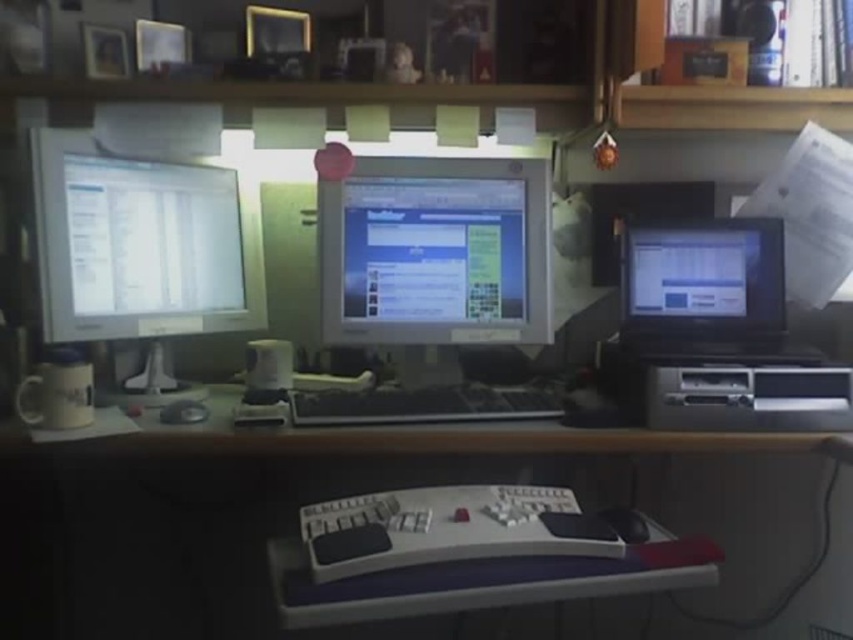
Can you confirm if matte silver monitor at left is bigger than matte plastic monitor at center?

Indeed, matte silver monitor at left has a larger size compared to matte plastic monitor at center.

Consider the image. Is matte silver monitor at left to the right of matte plastic monitor at center from the viewer's perspective?

Incorrect, matte silver monitor at left is not on the right side of matte plastic monitor at center.

Describe the element at coordinates (140, 250) in the screenshot. I see `matte silver monitor at left` at that location.

Locate an element on the screen. matte silver monitor at left is located at coordinates (140, 250).

Based on the photo, can you confirm if wooden computer desk at center is positioned below black rubber mouse at lower center?

Yes, wooden computer desk at center is below black rubber mouse at lower center.

Is wooden computer desk at center further to camera compared to black rubber mouse at lower center?

Yes, wooden computer desk at center is behind black rubber mouse at lower center.

What do you see at coordinates (347, 493) in the screenshot?
I see `wooden computer desk at center` at bounding box center [347, 493].

At what (x,y) coordinates should I click in order to perform the action: click on wooden computer desk at center. Please return your answer as a coordinate pair (x, y). The image size is (853, 640). Looking at the image, I should click on (347, 493).

Does black plastic keyboard at center lie behind black rubber mouse at lower center?

That is True.

What are the coordinates of `black plastic keyboard at center` in the screenshot? It's located at (422, 404).

Does point (494, 413) lie behind point (618, 518)?

Yes.

Find the location of a particular element. black plastic keyboard at center is located at coordinates (422, 404).